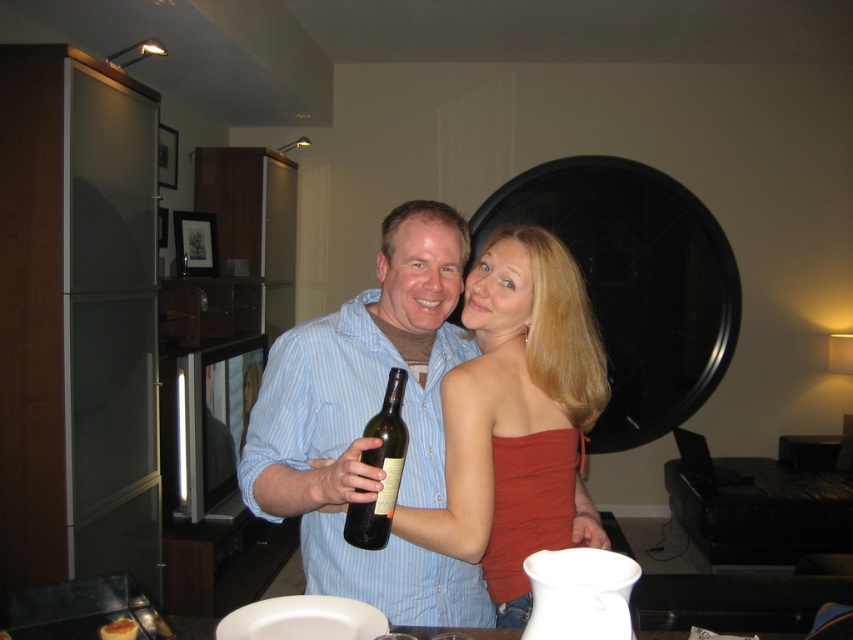
You are a photographer setting up for a portrait in the described scene. You need to ensure that the matte red strapless top at center and the green glass bottle at center are both visible in the frame. Based on their positions, which object is closer to the camera?

The matte red strapless top at center is positioned over the green glass bottle at center, meaning it is closer to the camera.

Looking at this image, you are a photographer setting up for a group photo. You notice the matte blue shirt at center and the matte red strapless top at center. Which clothing item is covering part of the other?

The matte blue shirt at center is positioned over the matte red strapless top at center, so the matte blue shirt at center is covering part of the matte red strapless top at center.

In the scene shown: You are standing at the origin point in the living room and see two points marked in the scene. Which point is closer to you, point (326, 410) or point (556, 328)?

Point (326, 410) is in front of point (556, 328), so it is closer to you.